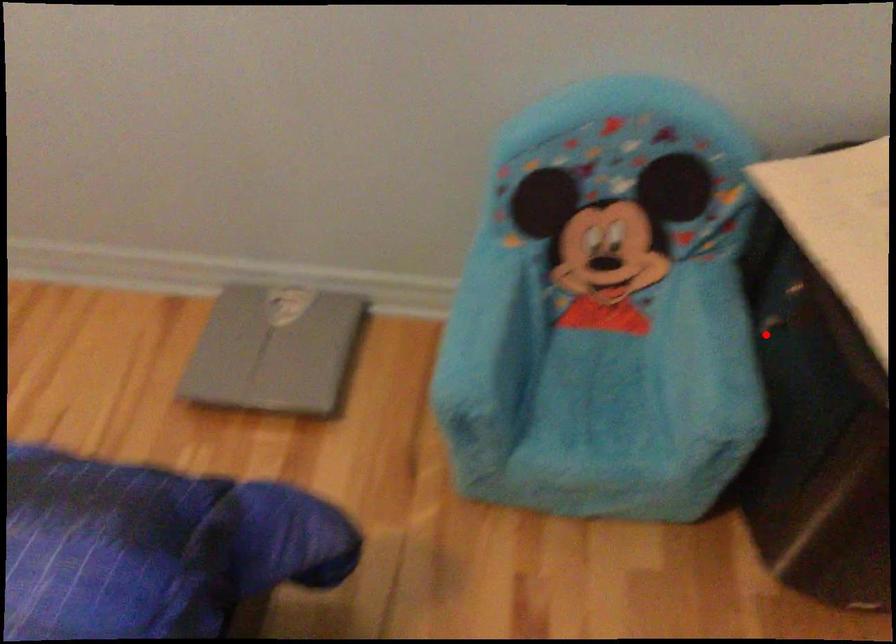
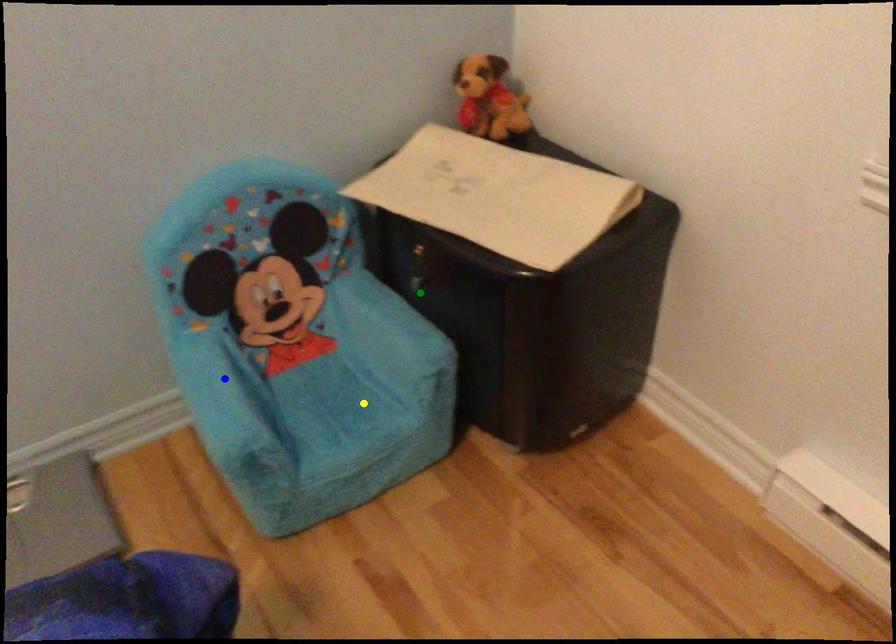
Question: I am providing you with two images of the same scene from different viewpoints. A red point is marked on the first image. You are given multiple points on the second image. Which mark in image 2 goes with the point in image 1?

Choices:
 (A) blue point
 (B) yellow point
 (C) green point

Answer: (C)